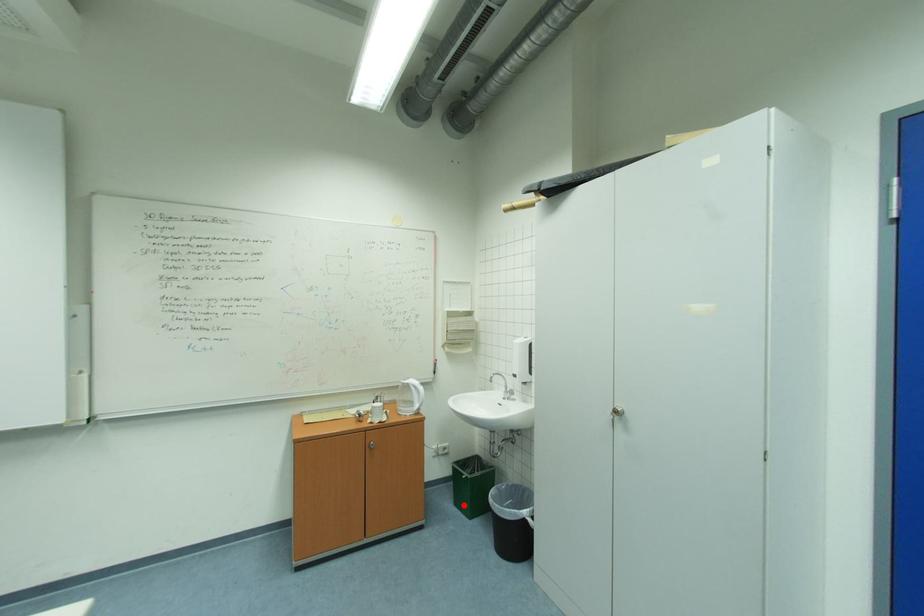
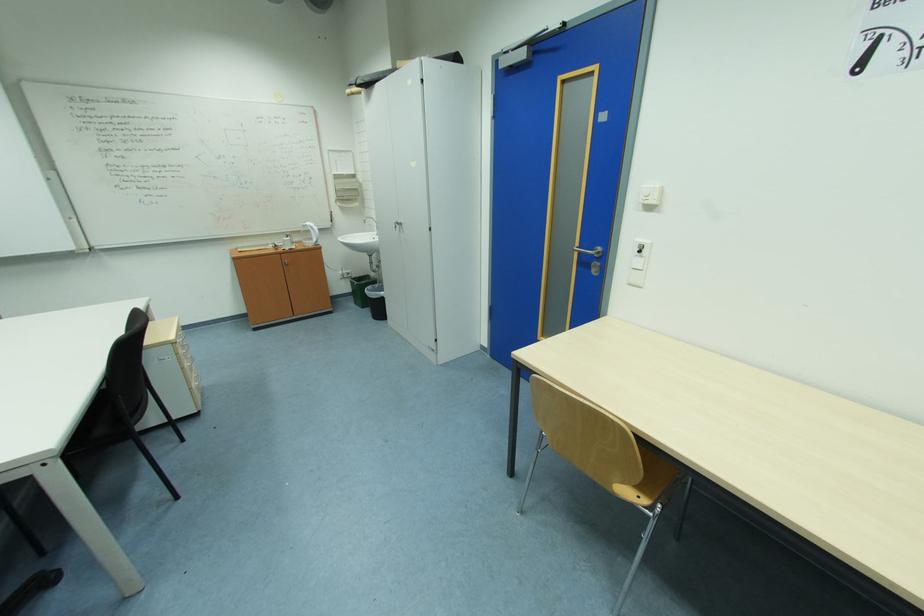
Question: I am providing you with two images of the same scene from different viewpoints. A red point is shown in image1. For the corresponding object point in image2, is it positioned nearer or farther from the camera?

Choices:
 (A) Nearer
 (B) Farther

Answer: (A)